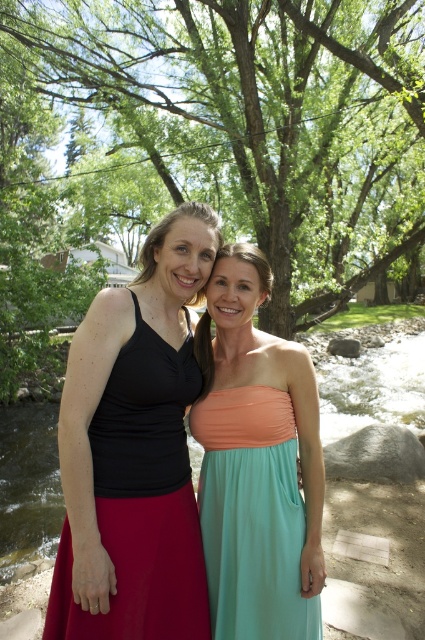
You are a photographer trying to capture a closeup shot of both the matte black dress at left and the teal satin strapless dress at center. Given that your camera has a minimum focus distance of 10 inches, will you be able to focus on both dresses simultaneously?

The matte black dress at left and teal satin strapless dress at center are 10.12 inches apart from each other. Since the minimum focus distance is 10 inches, the camera can focus on both dresses as they are just over the required distance.

You are a photographer setting up for a group photo. You need to position the matte black dress at left and the green fabric dress at center so that both are visible in the frame. Based on their current positions, which dress is higher in the image?

The matte black dress at left is above the green fabric dress at center, so it is higher in the image.